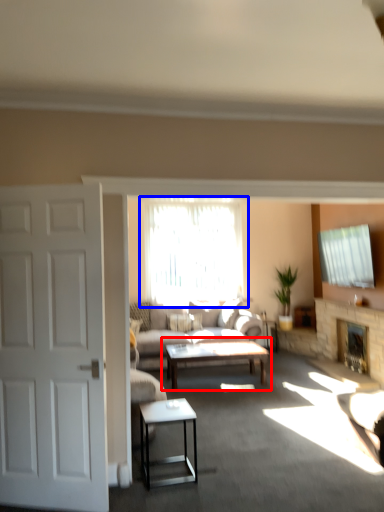
Question: Which of the following is the closest to the observer, coffee table (highlighted by a red box) or window (highlighted by a blue box)?

Choices:
 (A) coffee table
 (B) window

Answer: (A)